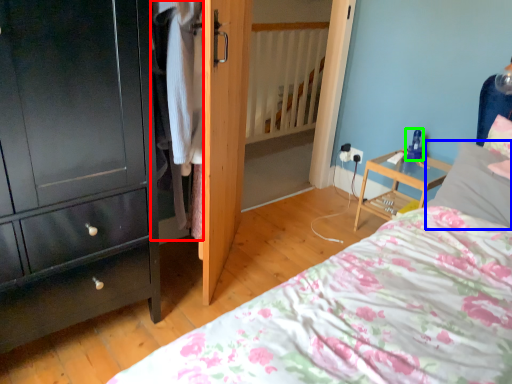
Question: Estimate the real-world distances between objects in this image. Which object is farther from clothing (highlighted by a red box), pillow (highlighted by a blue box) or toy (highlighted by a green box)?

Choices:
 (A) pillow
 (B) toy

Answer: (B)